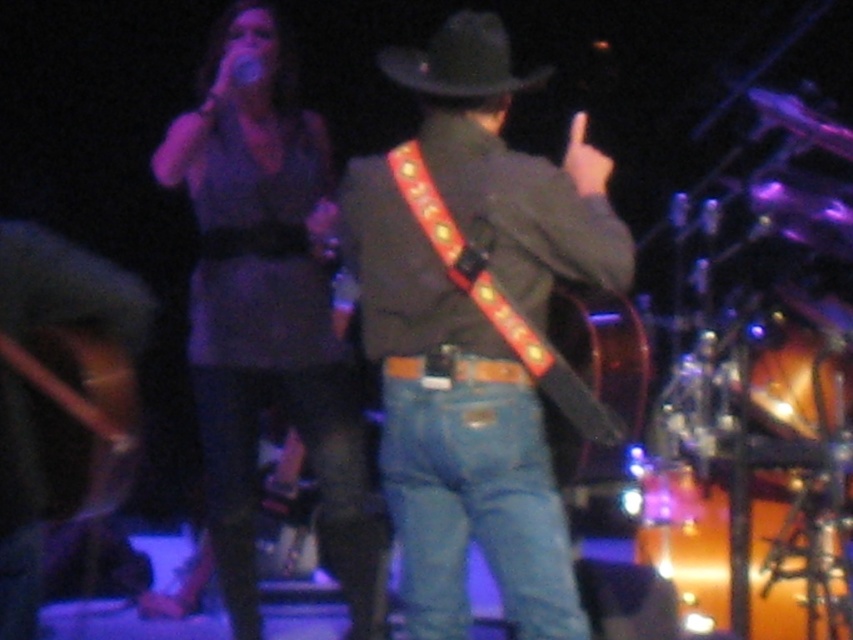
Does point (492, 352) come behind point (270, 131)?

No, (492, 352) is closer to viewer.

Consider the image. Does denim jeans at center have a greater height compared to matte purple dress at upper left?

No, denim jeans at center is not taller than matte purple dress at upper left.

Between point (397, 160) and point (259, 157), which one is positioned behind?

Point (259, 157)

Where is `denim jeans at center`? denim jeans at center is located at coordinates (476, 330).

Is denim jeans at center wider than black felt hat at upper center?

Correct, the width of denim jeans at center exceeds that of black felt hat at upper center.

Who is positioned more to the left, denim jeans at center or black felt hat at upper center?

black felt hat at upper center is more to the left.

Who is more distant from viewer, (x=590, y=180) or (x=445, y=24)?

The point (x=445, y=24) is more distant.

At what (x,y) coordinates should I click in order to perform the action: click on denim jeans at center. Please return your answer as a coordinate pair (x, y). The height and width of the screenshot is (640, 853). Looking at the image, I should click on (476, 330).

Does matte purple dress at upper left have a lesser width compared to black felt hat at upper center?

No, matte purple dress at upper left is not thinner than black felt hat at upper center.

The width and height of the screenshot is (853, 640). In order to click on matte purple dress at upper left in this screenshot , I will do click(270, 316).

You are a GUI agent. You are given a task and a screenshot of the screen. Output one action in this format:
    pyautogui.click(x=<x>, y=<y>)
    Task: Click on the matte purple dress at upper left
    The height and width of the screenshot is (640, 853).
    Given the screenshot: What is the action you would take?
    pyautogui.click(x=270, y=316)